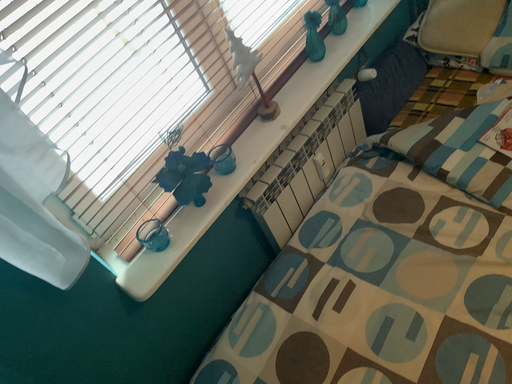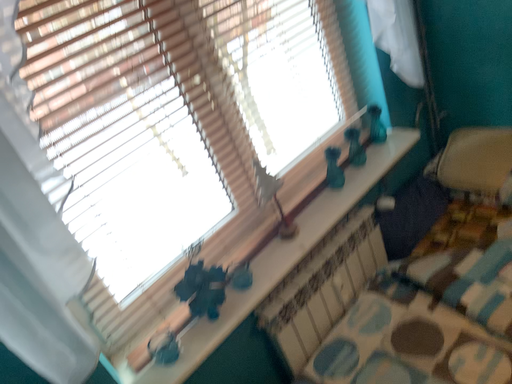
Question: Which way did the camera rotate in the video?

Choices:
 (A) rotated upward
 (B) rotated downward

Answer: (A)